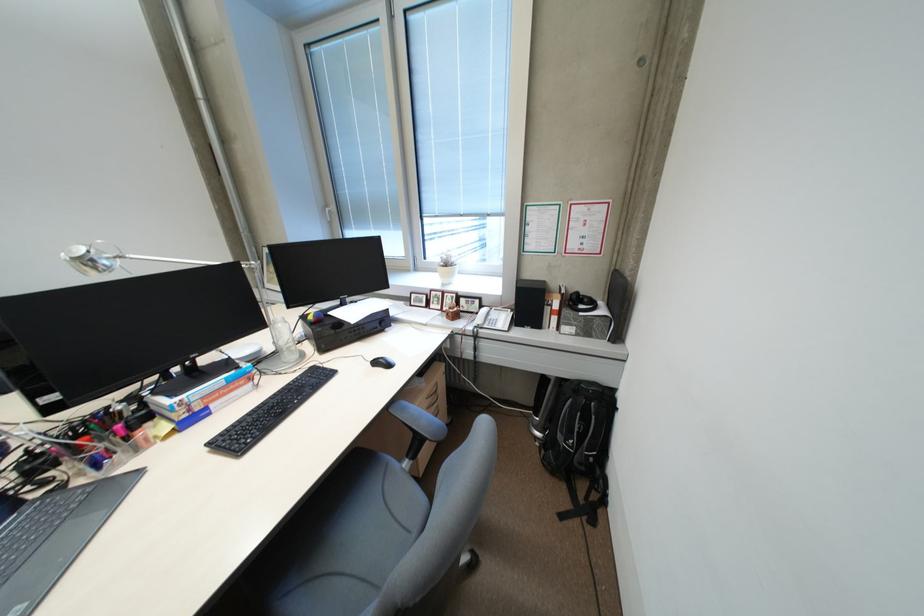
You are a GUI agent. You are given a task and a screenshot of the screen. Output one action in this format:
    pyautogui.click(x=<x>, y=<y>)
    Task: Click on the white telephone handset
    This screenshot has width=924, height=616.
    Given the screenshot: What is the action you would take?
    pyautogui.click(x=493, y=318)